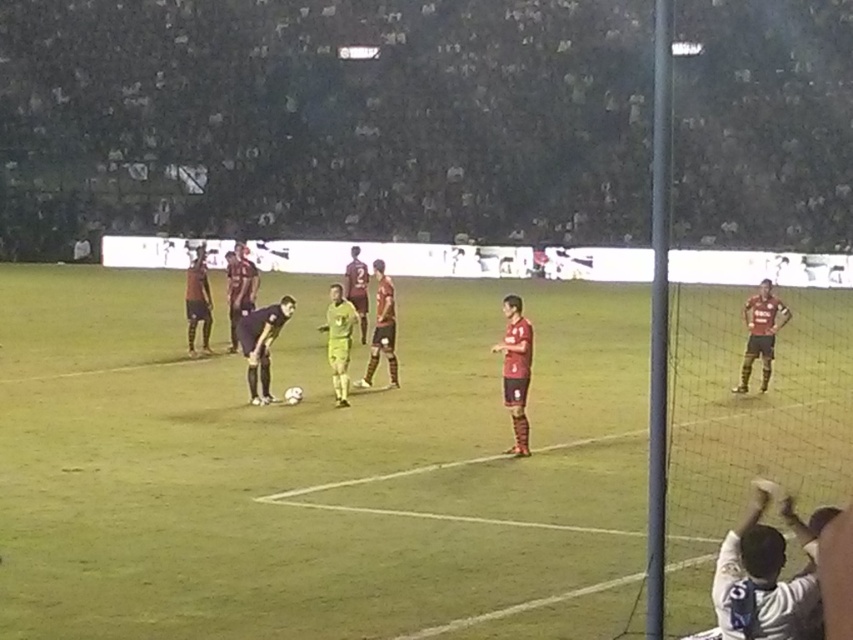
You are a photographer trying to capture a clear shot of both the maroon jersey at right and the dark brown leather pants at center. Based on their positions, which one is closer to the camera?

The maroon jersey at right is in front of the dark brown leather pants at center, so it is closer to the camera.

You are a photographer standing at the camera position capturing the nighttime soccer match. You want to place a spotlight exactly at the point marked as point [782,305]. The spotlight has a maximum range of 60 feet. Can the spotlight reach that point?

The point [782,305] is 65.61 feet away from the camera, which exceeds the spotlight maximum range of 60 feet. Therefore, the spotlight cannot reach that point.